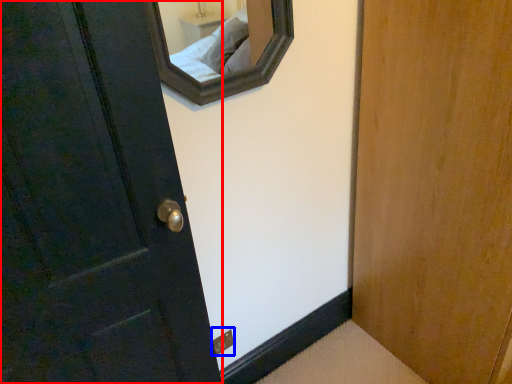
Question: Which point is further to the camera, door (highlighted by a red box) or electric outlet (highlighted by a blue box)?

Choices:
 (A) door
 (B) electric outlet

Answer: (B)